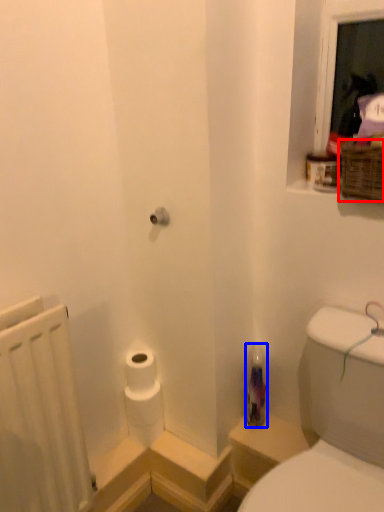
Question: Which object is further to the camera taking this photo, basket (highlighted by a red box) or bottle (highlighted by a blue box)?

Choices:
 (A) basket
 (B) bottle

Answer: (B)